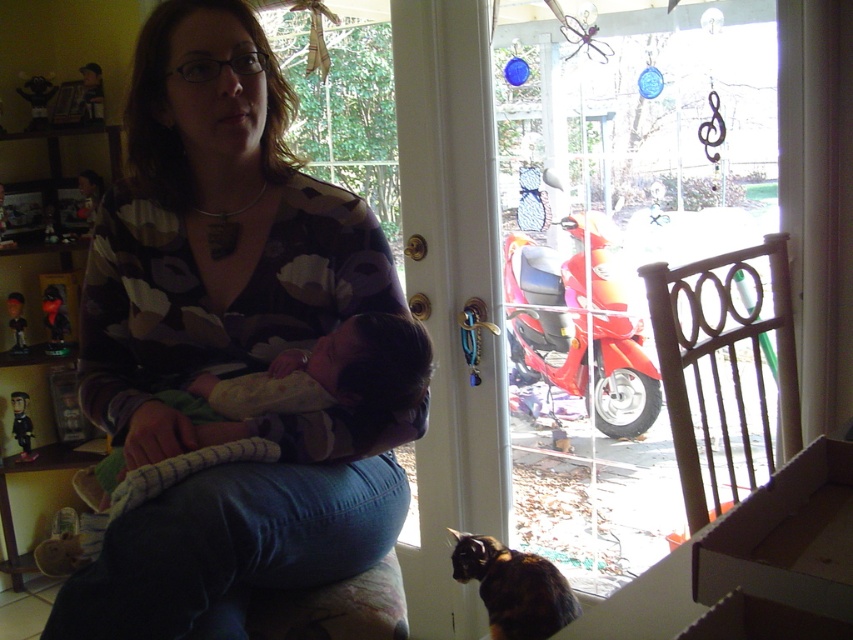
Question: Can you confirm if white cardboard box at lower right is bigger than calico fur cat at lower center?

Choices:
 (A) no
 (B) yes

Answer: (A)

Question: Is matte floral shirt at center below soft yellow fabric at center?

Choices:
 (A) yes
 (B) no

Answer: (B)

Question: Which object is farther from the camera taking this photo?

Choices:
 (A) white cardboard box at lower right
 (B) soft yellow fabric at center

Answer: (B)

Question: Does soft yellow fabric at center appear over calico fur cat at lower center?

Choices:
 (A) yes
 (B) no

Answer: (A)

Question: Which of the following is the closest to the observer?

Choices:
 (A) soft yellow fabric at center
 (B) calico fur cat at lower center
 (C) white cardboard box at lower right

Answer: (C)

Question: Among these points, which one is farthest from the camera?

Choices:
 (A) (129, 385)
 (B) (543, 609)
 (C) (805, 595)

Answer: (B)